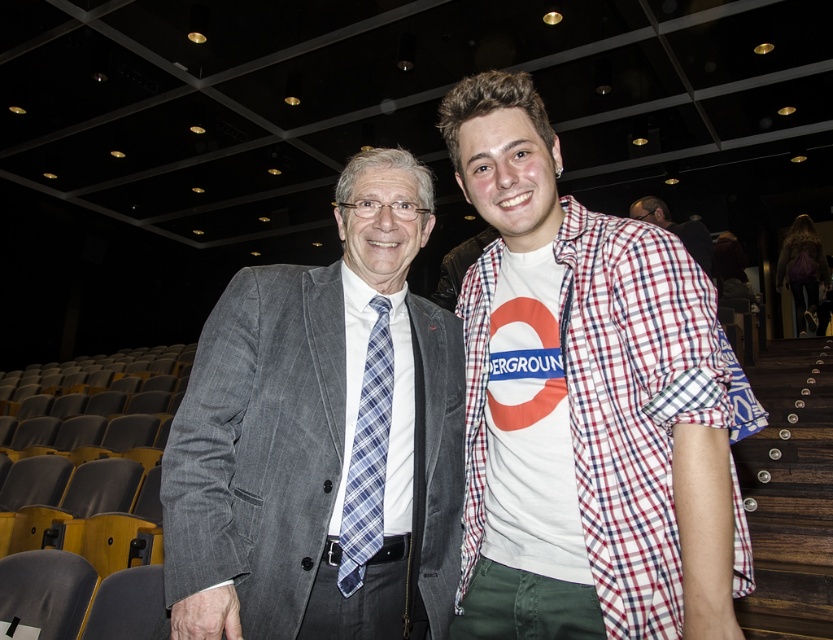
Question: Is gray wool suit at center below red plaid shirt at center?

Choices:
 (A) yes
 (B) no

Answer: (A)

Question: Does white cotton shirt at center lie in front of blue plaid tie at center?

Choices:
 (A) yes
 (B) no

Answer: (A)

Question: Which of the following is the farthest from the observer?

Choices:
 (A) white cotton shirt at center
 (B) red plaid shirt at center
 (C) gray wool suit at center
 (D) blue plaid tie at center

Answer: (B)

Question: Which object is the closest to the white cotton shirt at center?

Choices:
 (A) red plaid shirt at center
 (B) gray wool suit at center
 (C) blue plaid tie at center

Answer: (B)

Question: Is blue plaid tie at center positioned in front of red plaid shirt at center?

Choices:
 (A) yes
 (B) no

Answer: (A)

Question: Which point appears farthest from the camera in this image?

Choices:
 (A) (642, 218)
 (B) (580, 449)

Answer: (A)